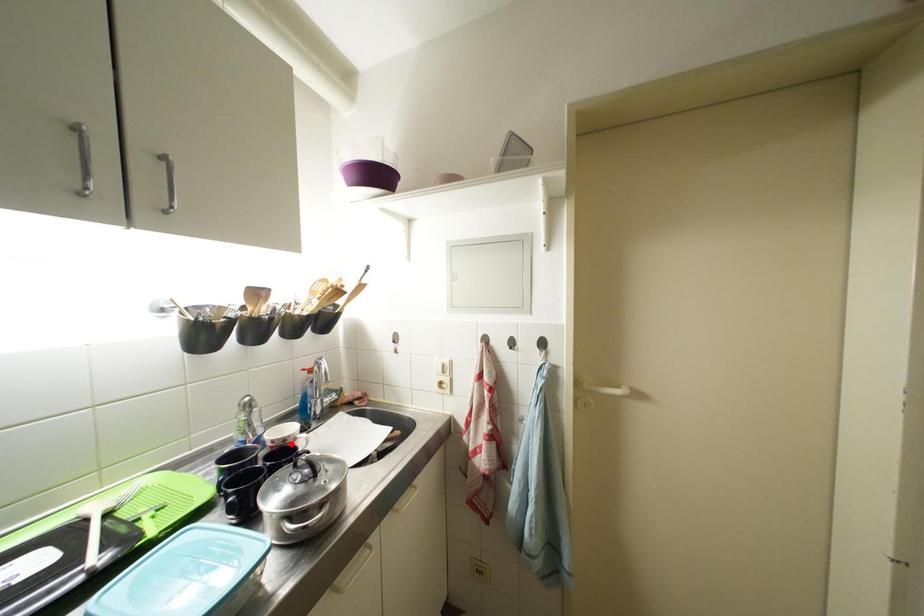
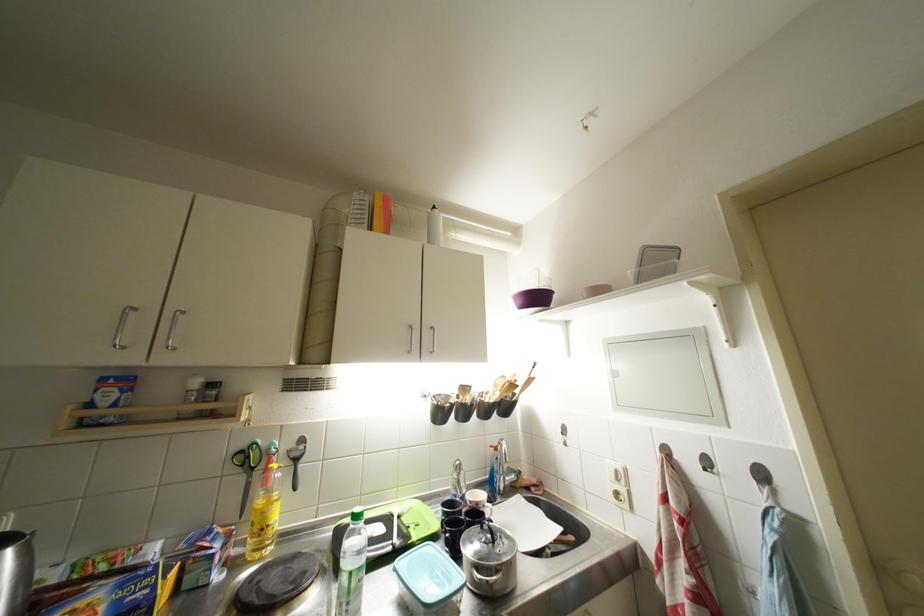
Where in the second image is the point corresponding to the highlighted location from the first image?

(483, 508)